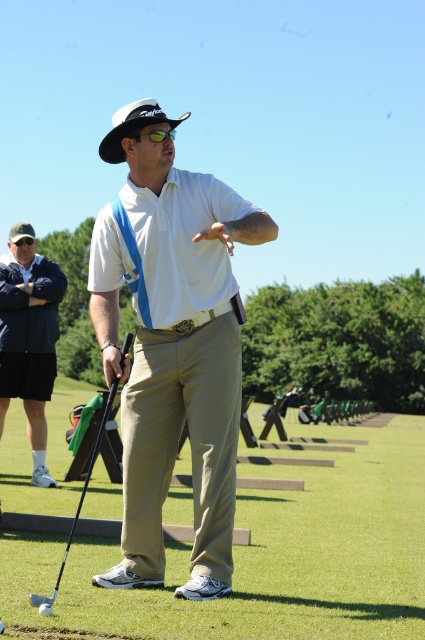
Consider the image. Can you confirm if white matte shirt at center is positioned below matte black golf club at lower left?

No.

Does white matte shirt at center have a greater width compared to matte black golf club at lower left?

Yes.

Find the location of a particular element. white matte shirt at center is located at coordinates coord(172,342).

What are the coordinates of `white matte shirt at center` in the screenshot? It's located at (172, 342).

Between point (14, 564) and point (53, 304), which one is positioned behind?

Point (53, 304)

Is khaki fabric pants at center further to the viewer compared to dark blue jacket at left?

That is False.

Is point (144, 636) positioned behind point (16, 333)?

No.

I want to click on khaki fabric pants at center, so click(x=266, y=557).

The height and width of the screenshot is (640, 425). Describe the element at coordinates (82, 493) in the screenshot. I see `matte black golf club at lower left` at that location.

Can you confirm if matte black golf club at lower left is positioned to the right of shiny black golf club at center?

Yes, matte black golf club at lower left is to the right of shiny black golf club at center.

Where is `matte black golf club at lower left`? This screenshot has height=640, width=425. matte black golf club at lower left is located at coordinates (82, 493).